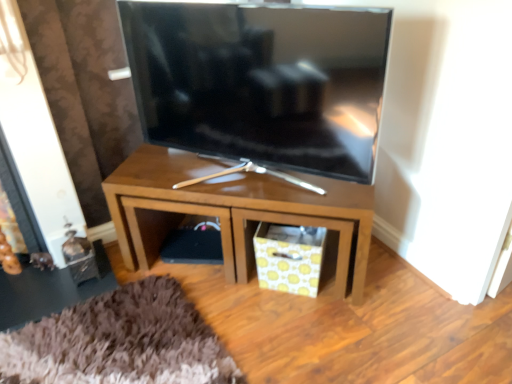
I want to click on vacant space in front of yellow patterned paper at lower center, so click(x=295, y=324).